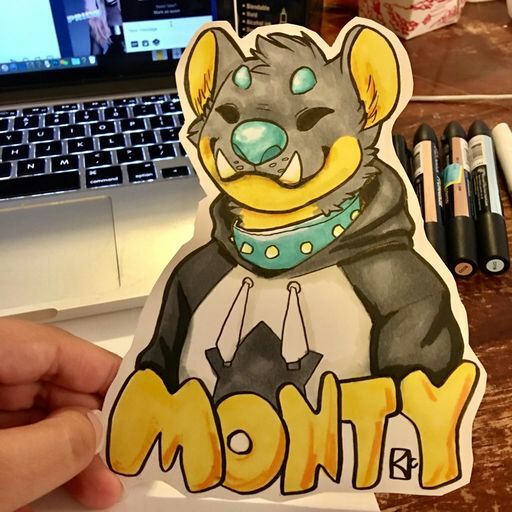
This screenshot has height=512, width=512. In order to click on markers in this screenshot , I will do `click(436, 184)`.